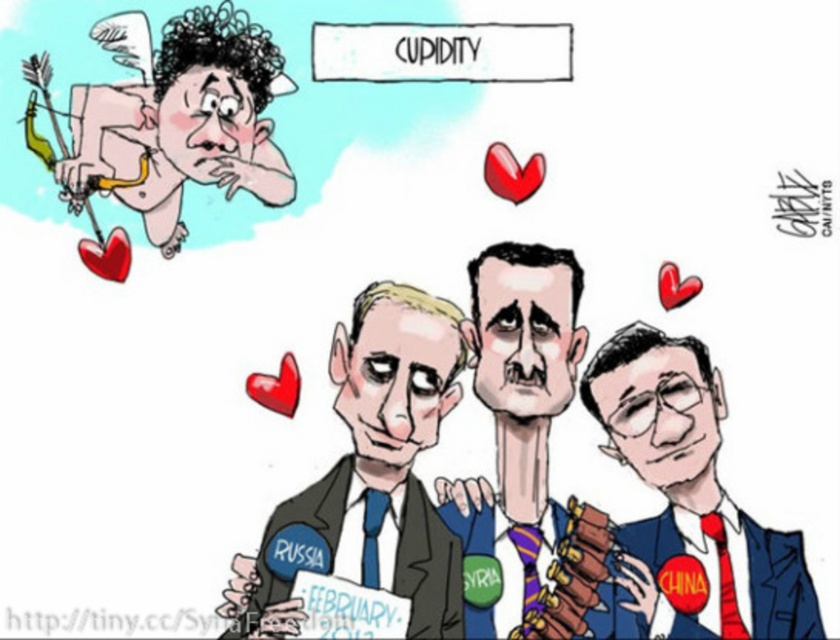
Question: Among these points, which one is nearest to the camera?

Choices:
 (A) (702, 372)
 (B) (396, 460)
 (C) (163, 124)

Answer: (C)

Question: Among these objects, which one is farthest from the camera?

Choices:
 (A) blue suit at lower right
 (B) dark blue suit at center

Answer: (B)

Question: Can you confirm if smooth blue suit at center is bigger than matte pink heart at upper left?

Choices:
 (A) no
 (B) yes

Answer: (B)

Question: Which is farther from the smooth blue suit at center?

Choices:
 (A) dark blue suit at center
 (B) matte pink heart at upper left

Answer: (B)

Question: Is blue suit at lower right thinner than matte pink heart at upper left?

Choices:
 (A) yes
 (B) no

Answer: (A)

Question: Does smooth blue suit at center come behind blue suit at lower right?

Choices:
 (A) no
 (B) yes

Answer: (A)